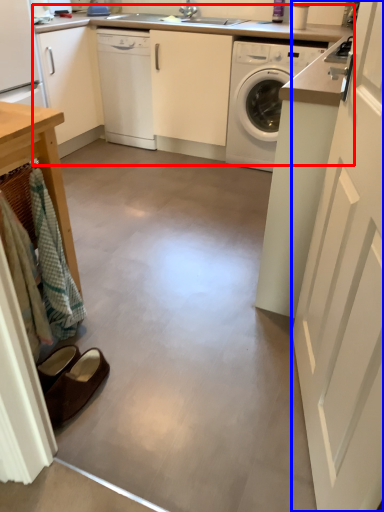
Question: Among these objects, which one is nearest to the camera, counter top (highlighted by a red box) or screen door (highlighted by a blue box)?

Choices:
 (A) counter top
 (B) screen door

Answer: (B)